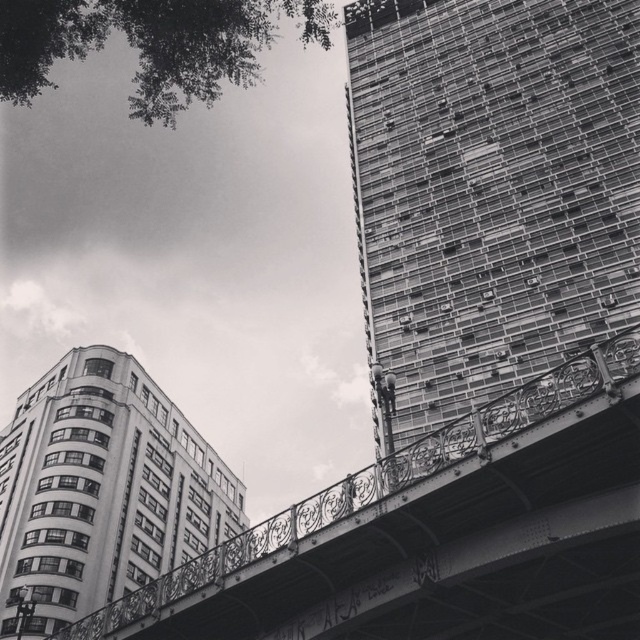
You are standing at the base of the bridge and looking up. Which object is positioned to the right of the other between the metallic glass building at upper right and the metallic bridge at center?

The metallic glass building at upper right is to the right of the metallic bridge at center according to the description.